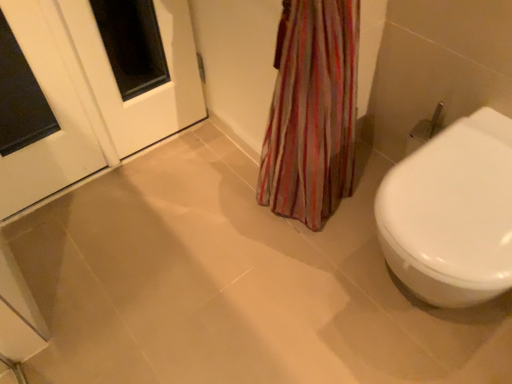
Question: Considering the relative sizes of white glossy bidet at right and white glossy door at upper left in the image provided, is white glossy bidet at right shorter than white glossy door at upper left?

Choices:
 (A) yes
 (B) no

Answer: (A)

Question: Is white glossy bidet at right placed right next to white glossy door at upper left?

Choices:
 (A) no
 (B) yes

Answer: (A)

Question: Does white glossy bidet at right come behind white glossy door at upper left?

Choices:
 (A) no
 (B) yes

Answer: (A)

Question: Would you say white glossy bidet at right contains white glossy door at upper left?

Choices:
 (A) yes
 (B) no

Answer: (B)

Question: From the image's perspective, is white glossy bidet at right beneath white glossy door at upper left?

Choices:
 (A) no
 (B) yes

Answer: (B)

Question: Considering the relative sizes of white glossy bidet at right and white glossy door at upper left in the image provided, is white glossy bidet at right thinner than white glossy door at upper left?

Choices:
 (A) no
 (B) yes

Answer: (A)

Question: Considering the relative sizes of white glossy door at upper left and white glossy bidet at right in the image provided, is white glossy door at upper left taller than white glossy bidet at right?

Choices:
 (A) yes
 (B) no

Answer: (A)

Question: Can you confirm if white glossy door at upper left is smaller than white glossy bidet at right?

Choices:
 (A) no
 (B) yes

Answer: (B)

Question: From a real-world perspective, is white glossy door at upper left beneath white glossy bidet at right?

Choices:
 (A) no
 (B) yes

Answer: (A)

Question: Is white glossy door at upper left bigger than white glossy bidet at right?

Choices:
 (A) no
 (B) yes

Answer: (A)

Question: Is white glossy bidet at right located within white glossy door at upper left?

Choices:
 (A) no
 (B) yes

Answer: (A)

Question: Considering the relative positions of white glossy door at upper left and white glossy bidet at right in the image provided, is white glossy door at upper left to the left of white glossy bidet at right from the viewer's perspective?

Choices:
 (A) no
 (B) yes

Answer: (B)

Question: From a real-world perspective, is white glossy door at upper left located higher than white glossy door at upper left?

Choices:
 (A) yes
 (B) no

Answer: (A)